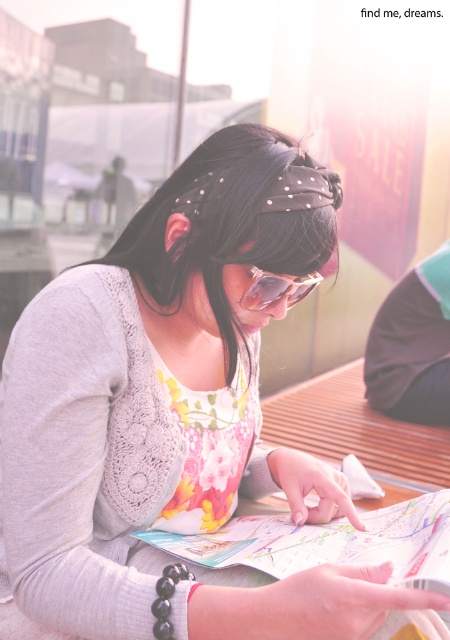
You are a photographer trying to capture the woman reading the map. You notice the dark fabric at lower right and the sunglasses at center. Which object is positioned lower in the image?

The dark fabric at lower right is positioned below the sunglasses at center, so it is lower in the image.

You are a photographer trying to capture the woman and her map in the scene. You need to ensure both the dark fabric at lower right and the sunglasses at center are visible in the frame. Which object should you focus on to ensure both are in the frame?

The dark fabric at lower right is bigger than the sunglasses at center, so focusing on the sunglasses at center ensures both objects are within the frame.

Looking at this image, you are a photographer trying to capture a candid shot of the woman without her noticing. You want to position yourself so that the dark fabric at lower right and sunglasses at center both frame the shot. Which object should you place closer to the edge of the frame to avoid blocking the main subject?

You should position the dark fabric at lower right closer to the edge of the frame because it is to the right of the sunglasses at center, so moving it towards the edge will keep the sunglasses at center focused on the main subject without obstruction.